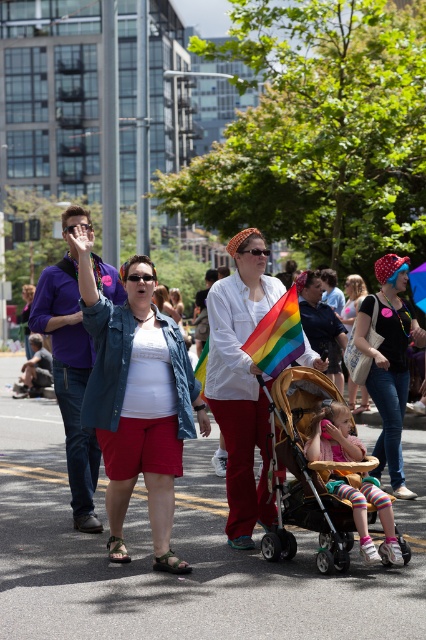
Question: Can you confirm if denim jacket at center is positioned below wooden baby carriage at center?

Choices:
 (A) yes
 (B) no

Answer: (B)

Question: Which point is closer to the camera?

Choices:
 (A) (382, 456)
 (B) (397, 547)

Answer: (B)

Question: Which point appears closest to the camera in this image?

Choices:
 (A) (218, 401)
 (B) (379, 272)
 (C) (354, 285)
 (D) (287, 376)

Answer: (D)

Question: Where is rainbow flag at center located in relation to striped leggings at center in the image?

Choices:
 (A) left
 (B) right

Answer: (A)

Question: Which point appears farthest from the camera in this image?

Choices:
 (A) (187, 401)
 (B) (402, 344)
 (C) (330, 403)
 (D) (149, 396)

Answer: (B)

Question: Where is matte black shirt at center located in relation to striped leggings at center in the image?

Choices:
 (A) left
 (B) right

Answer: (B)